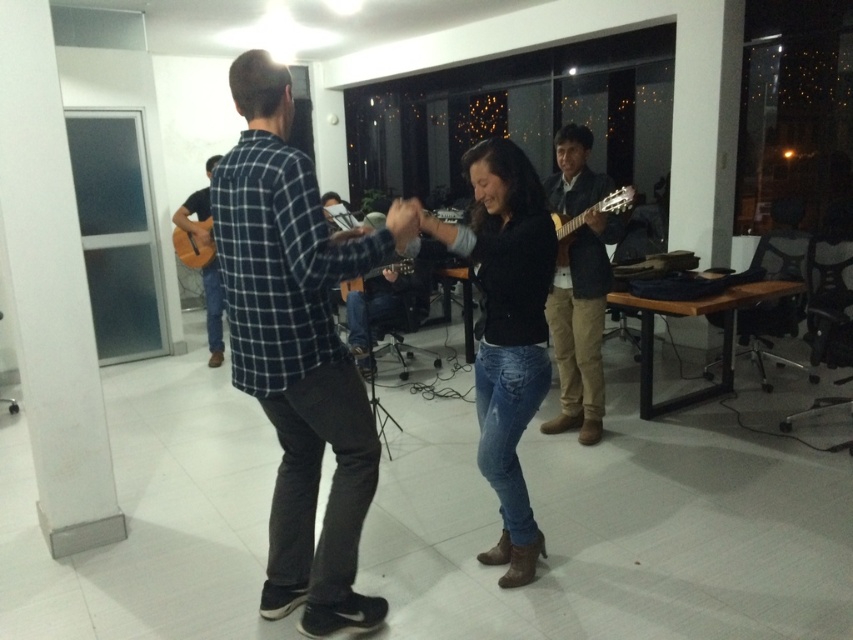
Question: Which object is farther from the camera taking this photo?

Choices:
 (A) blue plaid shirt at center
 (B) matte orange guitar at center
 (C) wooden acoustic guitar at left

Answer: (B)

Question: Which of the following is the closest to the observer?

Choices:
 (A) (201, 237)
 (B) (294, 362)
 (C) (560, 224)

Answer: (B)

Question: Can you confirm if brown suede shoes at right is wider than matte brown acoustic guitar at center?

Choices:
 (A) no
 (B) yes

Answer: (A)

Question: Is blue plaid shirt at center further to camera compared to matte black guitar at center?

Choices:
 (A) yes
 (B) no

Answer: (B)

Question: Which of the following is the closest to the observer?

Choices:
 (A) matte brown acoustic guitar at center
 (B) matte black guitar at center
 (C) denim jeans at center

Answer: (C)

Question: Is blue plaid shirt at center below matte black guitar at center?

Choices:
 (A) no
 (B) yes

Answer: (B)